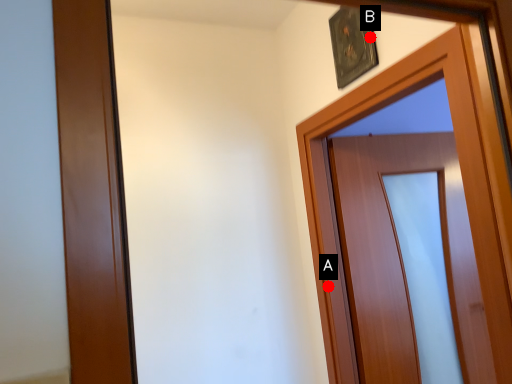
Question: Two points are circled on the image, labeled by A and B beside each circle. Which of the following is the farthest from the observer?

Choices:
 (A) A is further
 (B) B is further

Answer: (A)